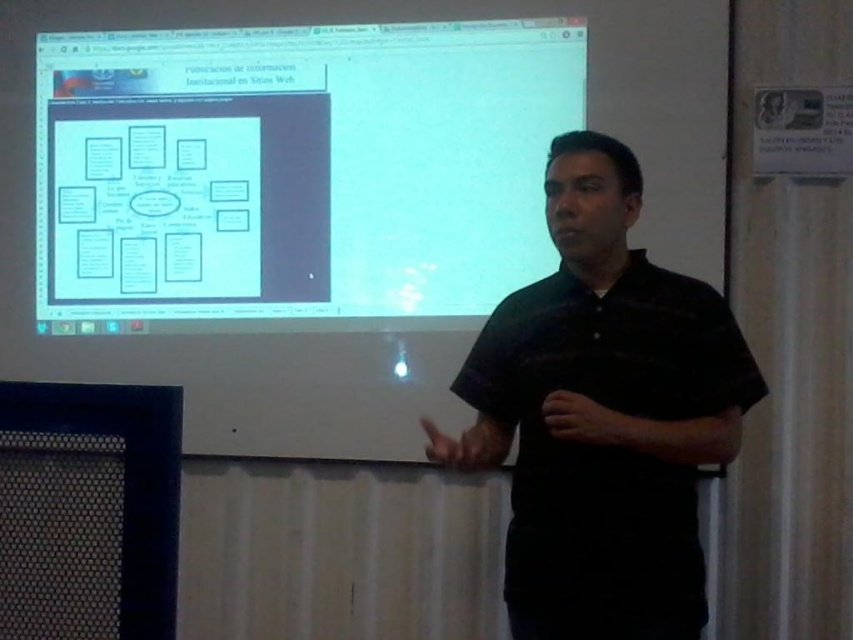
Can you confirm if white matte projection screen at upper center is positioned below black striped shirt at center?

Actually, white matte projection screen at upper center is above black striped shirt at center.

Is white matte projection screen at upper center positioned before black striped shirt at center?

No, white matte projection screen at upper center is behind black striped shirt at center.

Where is `white matte projection screen at upper center`? white matte projection screen at upper center is located at coordinates (294, 170).

In order to click on white matte projection screen at upper center in this screenshot , I will do `click(294, 170)`.